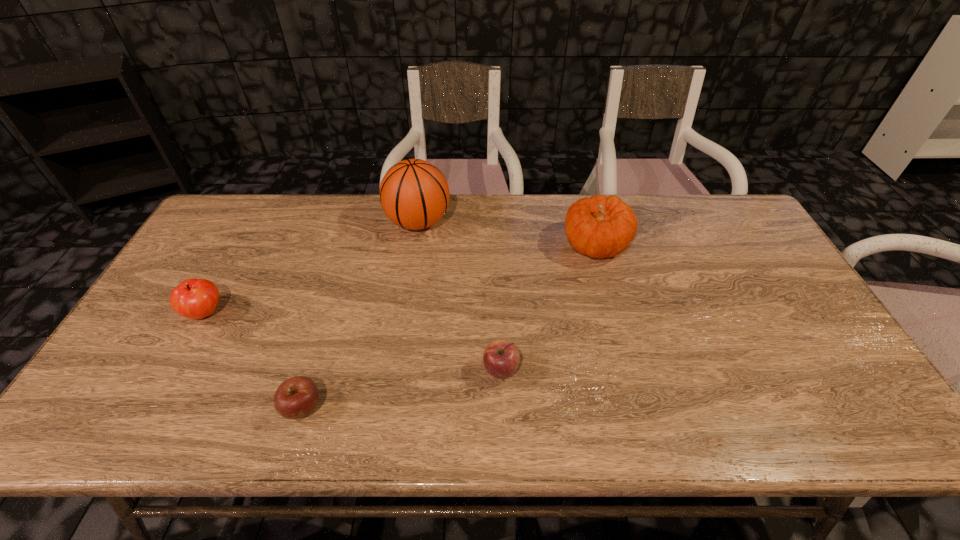
The width and height of the screenshot is (960, 540). I want to click on free space between the nearest apple and the leftmost object, so click(x=254, y=360).

At what (x,y) coordinates should I click in order to perform the action: click on free space between the nearest apple and the pumpkin. Please return your answer as a coordinate pair (x, y). The height and width of the screenshot is (540, 960). Looking at the image, I should click on (449, 326).

Locate an element on the screen. The height and width of the screenshot is (540, 960). free space between the third nearest object and the pumpkin is located at coordinates (400, 279).

Identify which object is located as the second nearest to the farthest apple. Please provide its 2D coordinates. Your answer should be formatted as a tuple, i.e. [(x, y)], where the tuple contains the x and y coordinates of a point satisfying the conditions above.

[(414, 194)]

Identify which object is located as the nearest to the leftmost object. Please provide its 2D coordinates. Your answer should be formatted as a tuple, i.e. [(x, y)], where the tuple contains the x and y coordinates of a point satisfying the conditions above.

[(297, 397)]

Locate an element on the screen. The width and height of the screenshot is (960, 540). apple that is the second closest to the fourth tallest object is located at coordinates click(193, 298).

Select which apple appears as the closest to the second nearest object. Please provide its 2D coordinates. Your answer should be formatted as a tuple, i.e. [(x, y)], where the tuple contains the x and y coordinates of a point satisfying the conditions above.

[(297, 397)]

Find the location of a particular element. vacant space that satisfies the following two spatial constraints: 1. on the back side of the third farthest object; 2. on the left side of the second tallest object is located at coordinates (243, 245).

At what (x,y) coordinates should I click in order to perform the action: click on vacant area that satisfies the following two spatial constraints: 1. on the back side of the farthest apple; 2. on the left side of the fourth shortest object. Please return your answer as a coordinate pair (x, y). This screenshot has width=960, height=540. Looking at the image, I should click on (243, 245).